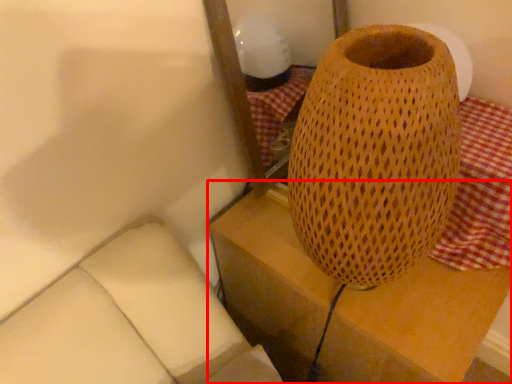
Question: In this image, where is furniture (annotated by the red box) located relative to tablecloth?

Choices:
 (A) right
 (B) left

Answer: (B)